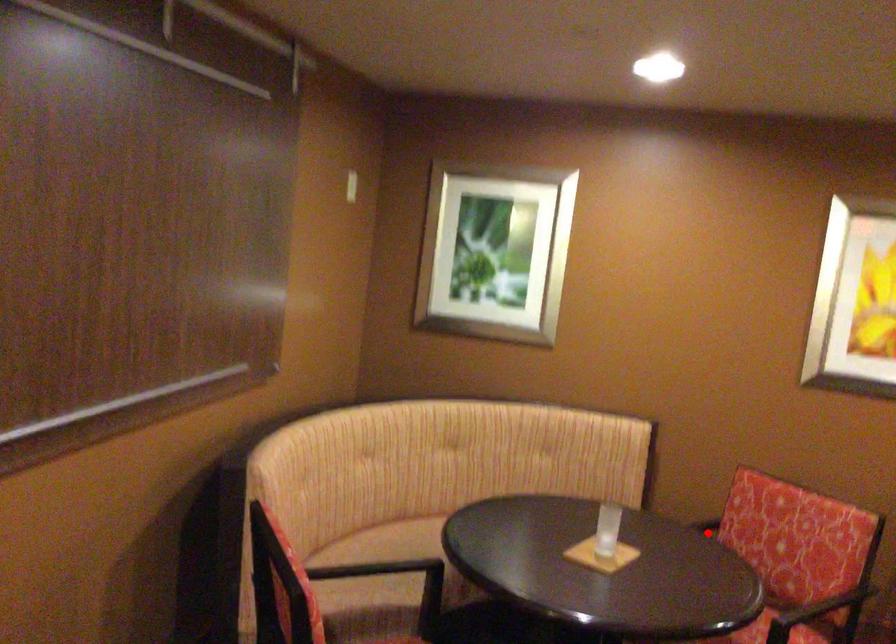
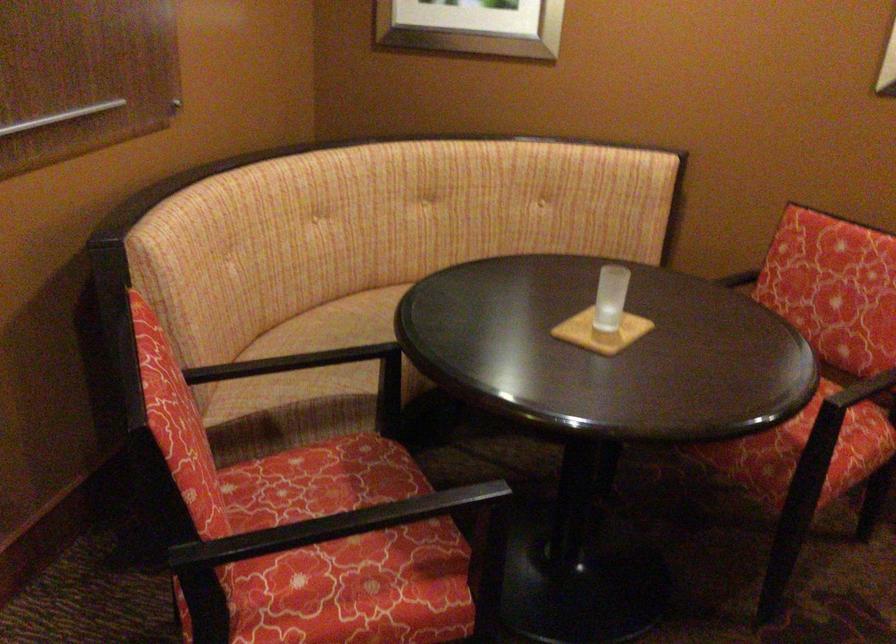
In the second image, find the point that corresponds to the highlighted location in the first image.

(738, 279)